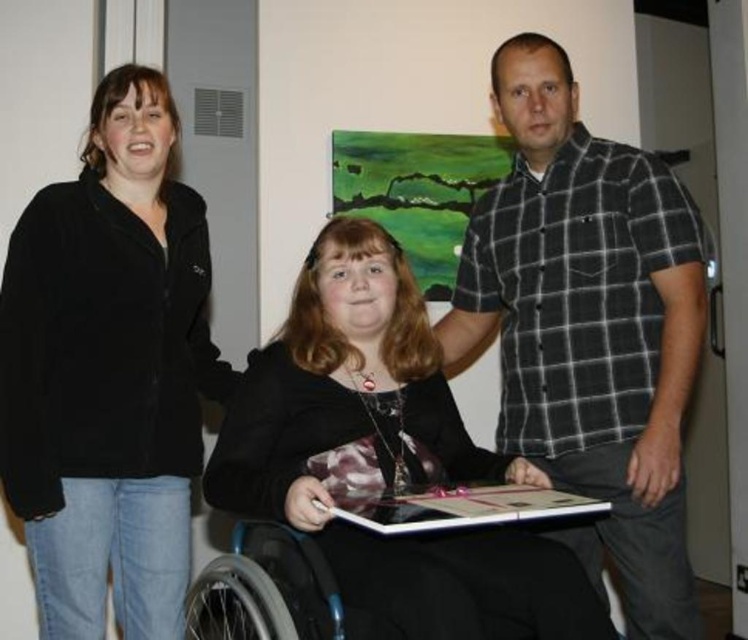
Looking at this image, you are a photographer setting up a shoot in this room. You need to position a light source to illuminate the black fleece jacket at left and the black matte wheelchair at center. Since the jacket is above the wheelchair, where should you place the light to ensure both are well lit without creating harsh shadows?

Place the light source above both the black fleece jacket at left and the black matte wheelchair at center. This way, the light will naturally illuminate the jacket which is positioned above the wheelchair, and the wheelchair below, avoiding harsh shadows between them.